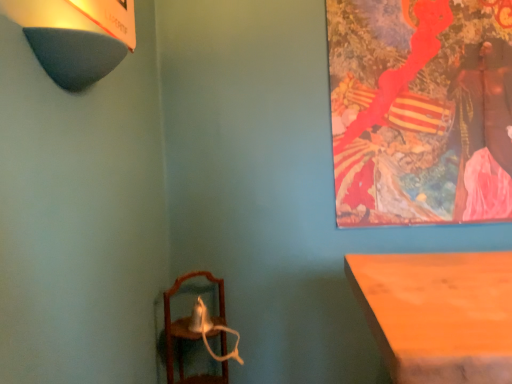
Question: From the image's perspective, is dark gray felt lampshade at upper left positioned above or below painted canvas at upper right?

Choices:
 (A) below
 (B) above

Answer: (A)

Question: In the image, is dark gray felt lampshade at upper left on the left side or the right side of painted canvas at upper right?

Choices:
 (A) left
 (B) right

Answer: (A)

Question: Considering the real-world distances, which object is closest to the dark gray felt lampshade at upper left?

Choices:
 (A) wooden mirror at lower left
 (B) painted canvas at upper right

Answer: (A)

Question: Which is farther from the wooden mirror at lower left?

Choices:
 (A) dark gray felt lampshade at upper left
 (B) painted canvas at upper right

Answer: (A)